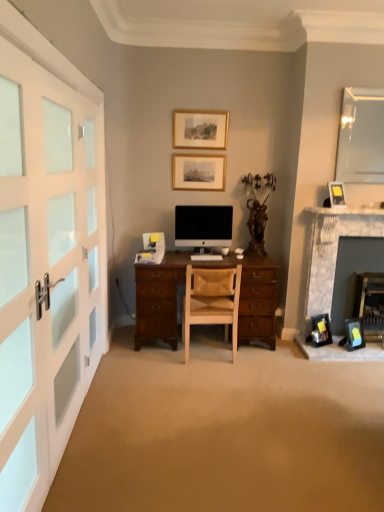
Question: From a real-world perspective, is matte black picture frame at lower right, arranged as the 5th picture frame when viewed from the top, physically above leather at center?

Choices:
 (A) yes
 (B) no

Answer: (B)

Question: Can leather at center be found inside matte black picture frame at lower right, arranged as the 5th picture frame when viewed from the top?

Choices:
 (A) yes
 (B) no

Answer: (B)

Question: Is matte black picture frame at lower right, which is counted as the first picture frame, starting from the right, bigger than leather at center?

Choices:
 (A) no
 (B) yes

Answer: (A)

Question: Is matte black picture frame at lower right, arranged as the 5th picture frame when viewed from the top, wider than leather at center?

Choices:
 (A) yes
 (B) no

Answer: (B)

Question: Is matte black picture frame at lower right, which ranks as the first picture frame in bottom-to-top order, to the right of leather at center from the viewer's perspective?

Choices:
 (A) no
 (B) yes

Answer: (B)

Question: Relative to leather at center, is matte gold picture frame at upper center, which is the 1th picture frame from left to right, in front or behind?

Choices:
 (A) front
 (B) behind

Answer: (B)

Question: Is matte gold picture frame at upper center, which is the 1th picture frame from left to right, taller or shorter than leather at center?

Choices:
 (A) tall
 (B) short

Answer: (B)

Question: Is point (x=173, y=167) closer or farther from the camera than point (x=215, y=291)?

Choices:
 (A) closer
 (B) farther

Answer: (B)

Question: From the image's perspective, is matte gold picture frame at upper center, which ranks as the fifth picture frame in right-to-left order, above or below leather at center?

Choices:
 (A) above
 (B) below

Answer: (A)

Question: In terms of height, does satin black monitor at center look taller or shorter compared to matte gold picture frame at upper right, which ranks as the 4th picture frame in left-to-right order?

Choices:
 (A) tall
 (B) short

Answer: (A)

Question: Considering the relative positions of satin black monitor at center and matte gold picture frame at upper right, which ranks as the 4th picture frame in left-to-right order, in the image provided, is satin black monitor at center to the left or to the right of matte gold picture frame at upper right, which ranks as the 4th picture frame in left-to-right order,?

Choices:
 (A) right
 (B) left

Answer: (B)

Question: From a real-world perspective, is satin black monitor at center above or below matte gold picture frame at upper right, which ranks as the 4th picture frame in left-to-right order?

Choices:
 (A) below
 (B) above

Answer: (A)

Question: Is satin black monitor at center bigger or smaller than matte gold picture frame at upper right, which is the 3th picture frame in bottom-to-top order?

Choices:
 (A) small
 (B) big

Answer: (B)

Question: From the image's perspective, relative to white frosted glass doors at left, is matte black picture frame at lower right, which appears as the 2th picture frame when ordered from the bottom, above or below?

Choices:
 (A) below
 (B) above

Answer: (A)

Question: Is point (312, 340) closer or farther from the camera than point (74, 365)?

Choices:
 (A) closer
 (B) farther

Answer: (B)